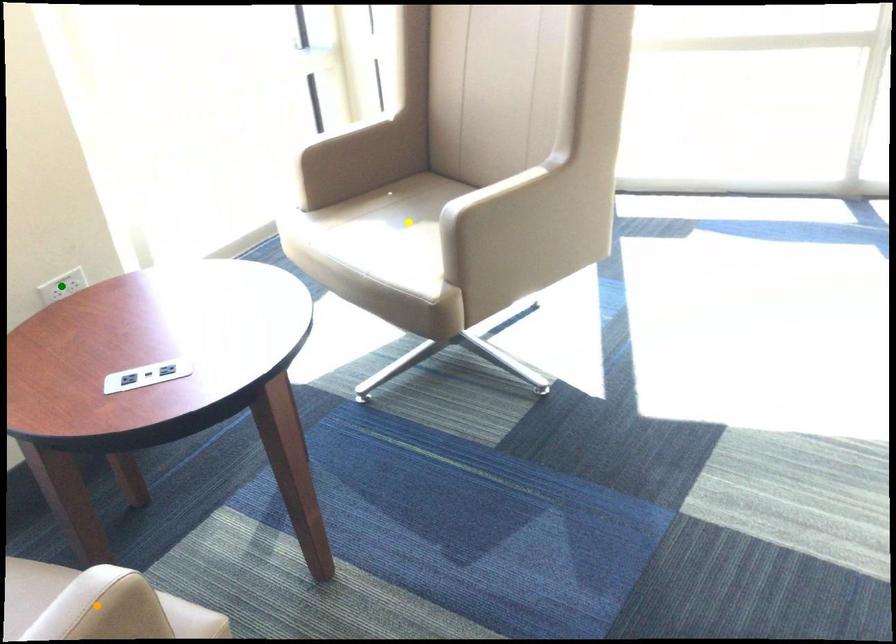
Order these from nearest to farthest:
A) green point
B) yellow point
C) orange point

yellow point → green point → orange point